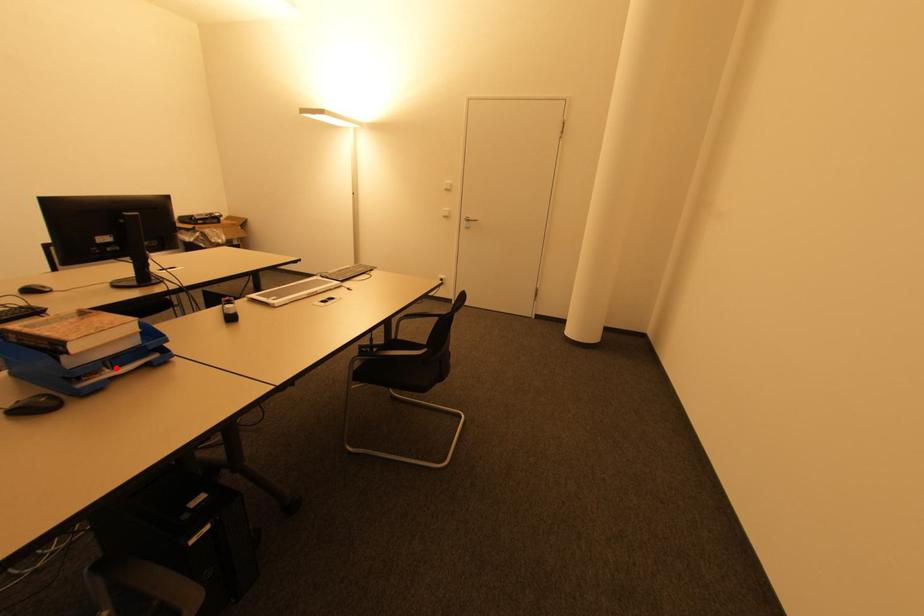
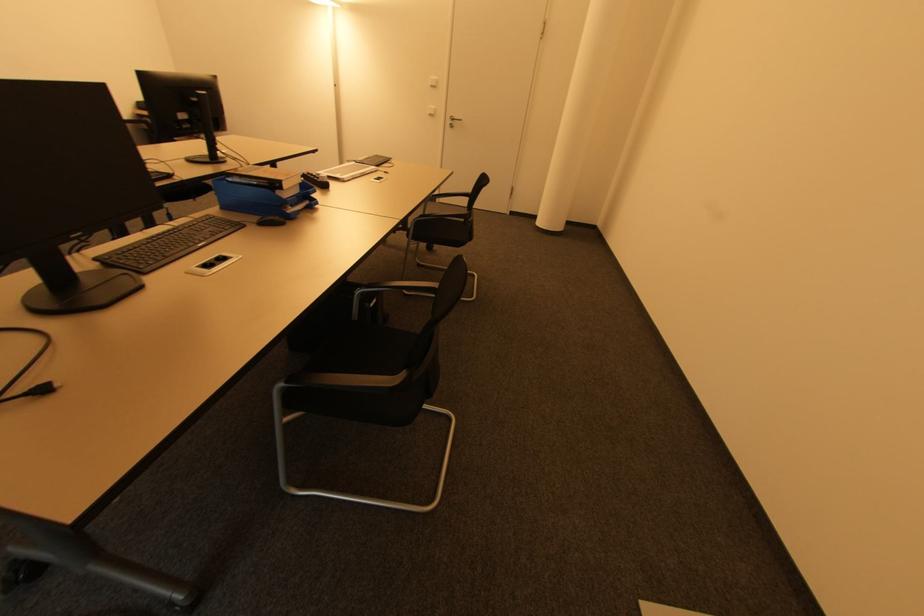
Question: I am providing you with two images of the same scene from different viewpoints. A red point is marked on the first image. Is the red point's position out of view in image 2?

Choices:
 (A) Yes
 (B) No

Answer: (B)